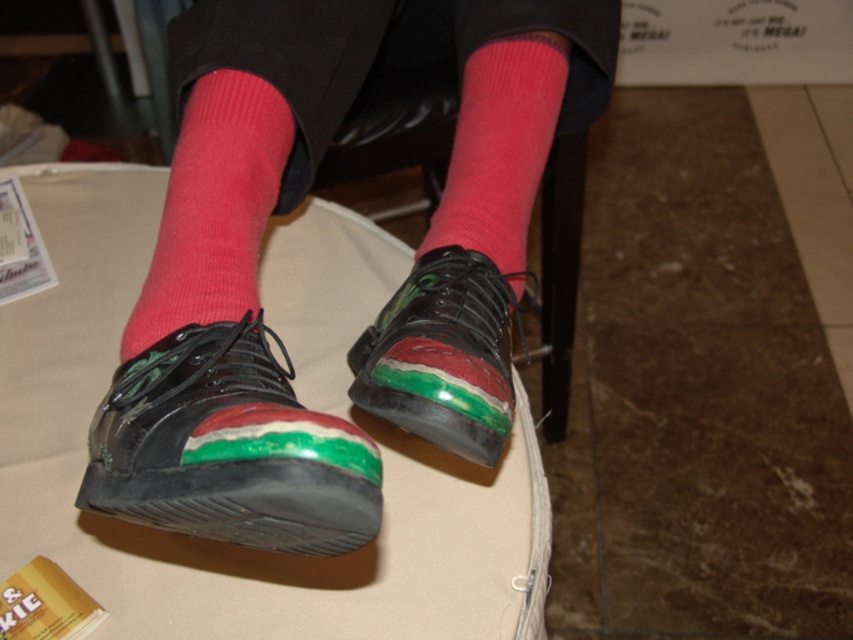
You are a photographer setting up a shoot and need to position a camera to capture both the rubberized plastic table at center and the shiny black shoe at lower center. Which object should you focus on first if you want to ensure both are in sharp focus?

You should focus on the rubberized plastic table at center first because it is closer to the viewer than the shiny black shoe at lower center. By focusing on the closer object, the farther object will also be in focus due to the depth of field.